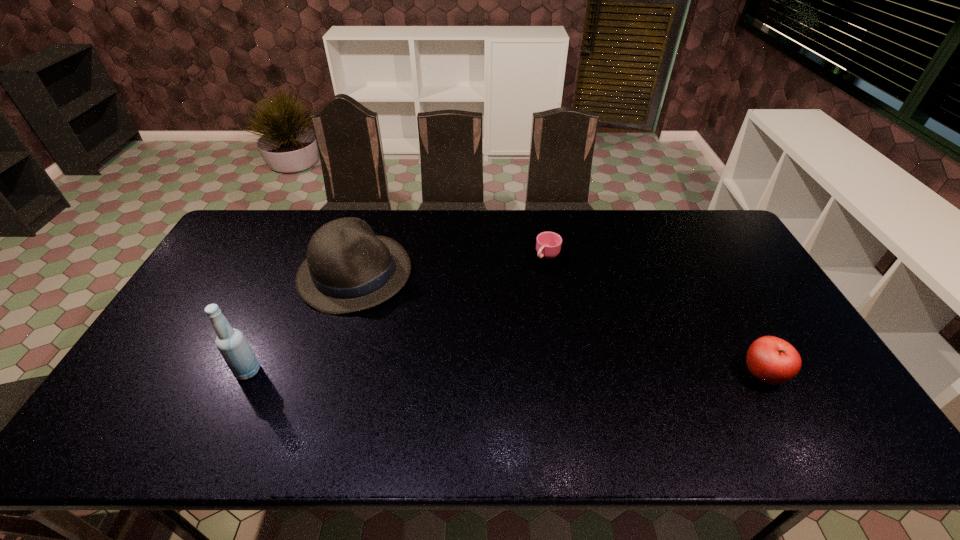
The width and height of the screenshot is (960, 540). Identify the location of the tallest object. (234, 348).

Image resolution: width=960 pixels, height=540 pixels. I want to click on apple, so click(x=772, y=360).

Identify the location of the third tallest object. This screenshot has height=540, width=960. (772, 360).

Where is `bowler hat`? bowler hat is located at coordinates (348, 268).

Identify the location of cup. (548, 250).

Identify the location of the second object from right to left. The height and width of the screenshot is (540, 960). pyautogui.click(x=548, y=250).

Where is `free location located on the right of the tallest object`? This screenshot has width=960, height=540. free location located on the right of the tallest object is located at coordinates (388, 371).

In order to click on free space located on the back of the second shortest object in this screenshot , I will do `click(704, 268)`.

This screenshot has width=960, height=540. In order to click on vacant space located 0.360m on the front-facing side of the third shortest object in this screenshot , I will do `click(490, 357)`.

This screenshot has width=960, height=540. In order to click on free space located 0.150m on the front-facing side of the third shortest object in this screenshot , I will do `click(431, 321)`.